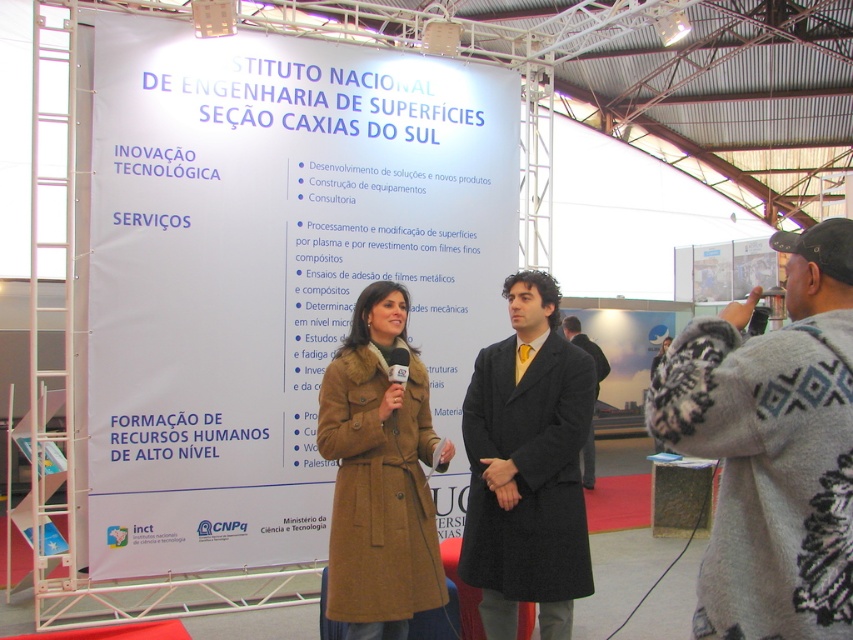
Does dark gray wool coat at center come in front of brown wool coat at center?

No, it is not.

How much distance is there between dark gray wool coat at center and brown wool coat at center?

16.31 inches

This screenshot has width=853, height=640. Find the location of `dark gray wool coat at center`. dark gray wool coat at center is located at coordinates (527, 467).

Is brown wool coat at center below dark gray coat at center?

Indeed, brown wool coat at center is positioned under dark gray coat at center.

Who is more distant from viewer, (370, 524) or (570, 339)?

The point (570, 339) is more distant.

Based on the photo, measure the distance between point (404, 316) and camera.

The distance of point (404, 316) from camera is 3.36 meters.

The image size is (853, 640). I want to click on brown wool coat at center, so click(379, 474).

Which of these two, knitted gray sweater at right or dark gray wool coat at center, stands shorter?

With less height is knitted gray sweater at right.

Who is positioned more to the left, knitted gray sweater at right or dark gray wool coat at center?

From the viewer's perspective, dark gray wool coat at center appears more on the left side.

Who is more distant from viewer, [747,515] or [490,488]?

The point [490,488] is behind.

Locate an element on the screen. knitted gray sweater at right is located at coordinates (772, 448).